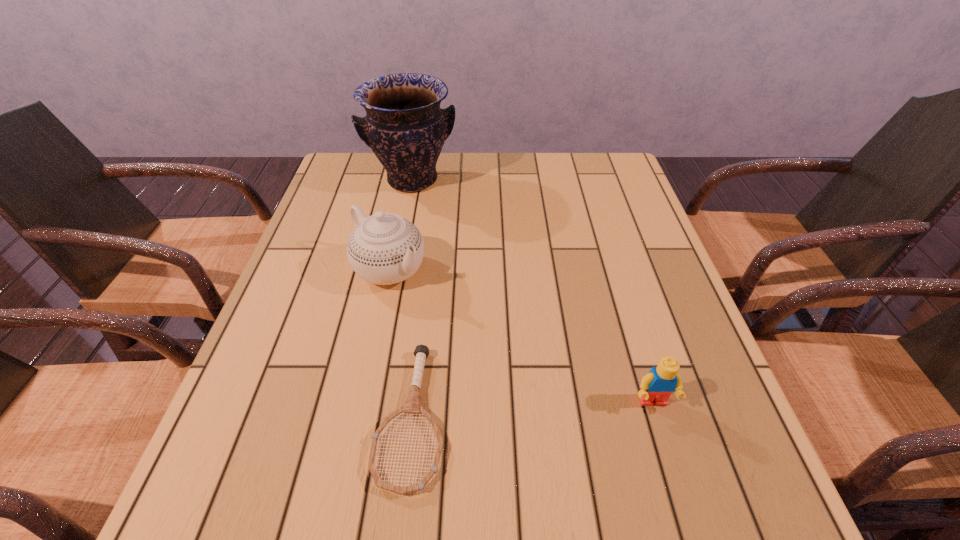
At what (x,y) coordinates should I click in order to perform the action: click on vacant region between the shortest object and the pottery. Please return your answer as a coordinate pair (x, y). Looking at the image, I should click on (412, 299).

Locate an element on the screen. unoccupied area between the shortest object and the second farthest object is located at coordinates (400, 343).

You are a GUI agent. You are given a task and a screenshot of the screen. Output one action in this format:
    pyautogui.click(x=<x>, y=<y>)
    Task: Click on the free spot between the second tallest object and the tennis racket
    This screenshot has height=540, width=960.
    Given the screenshot: What is the action you would take?
    pyautogui.click(x=400, y=343)

This screenshot has width=960, height=540. Identify the location of free spot between the second shortest object and the chinaware. (521, 336).

At what (x,y) coordinates should I click in order to perform the action: click on vacant point located between the third tallest object and the third nearest object. Please return your answer as a coordinate pair (x, y). Looking at the image, I should click on (521, 336).

At what (x,y) coordinates should I click in order to perform the action: click on object that stands as the closest to the second shortest object. Please return your answer as a coordinate pair (x, y). Looking at the image, I should click on (413, 406).

This screenshot has width=960, height=540. Find the location of `the third closest object to the third shortest object`. the third closest object to the third shortest object is located at coordinates (656, 387).

The image size is (960, 540). I want to click on free spot that satisfies the following two spatial constraints: 1. on the front side of the shortest object; 2. on the left side of the third shortest object, so click(x=358, y=416).